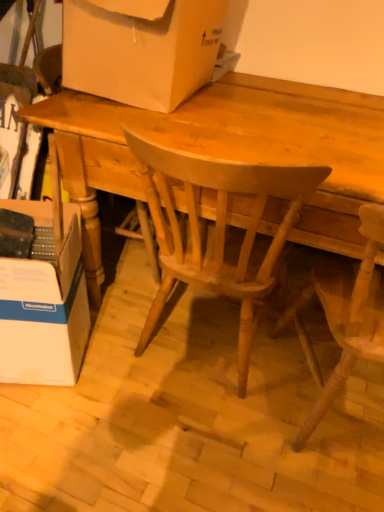
Where is `vacant area located to the right-hand side of matte cardboard box at upper center, acting as the second box starting from the bottom`? vacant area located to the right-hand side of matte cardboard box at upper center, acting as the second box starting from the bottom is located at coordinates (300, 99).